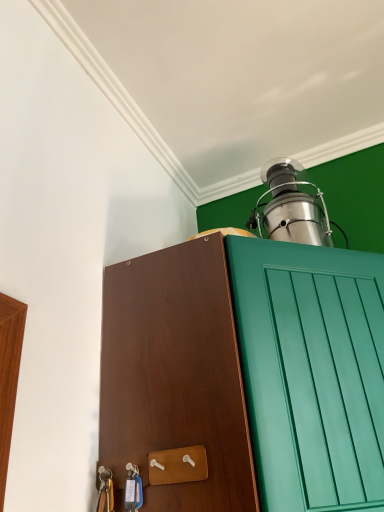
Question: Are stainless steel oil lamp at upper right and brown wood cabinet at center far apart?

Choices:
 (A) yes
 (B) no

Answer: (B)

Question: Can we say stainless steel oil lamp at upper right lies outside brown wood cabinet at center?

Choices:
 (A) no
 (B) yes

Answer: (B)

Question: Can brown wood cabinet at center be found inside stainless steel oil lamp at upper right?

Choices:
 (A) yes
 (B) no

Answer: (B)

Question: Does stainless steel oil lamp at upper right come in front of brown wood cabinet at center?

Choices:
 (A) no
 (B) yes

Answer: (A)

Question: From the image's perspective, is stainless steel oil lamp at upper right below brown wood cabinet at center?

Choices:
 (A) yes
 (B) no

Answer: (B)

Question: Does stainless steel oil lamp at upper right have a greater height compared to brown wood cabinet at center?

Choices:
 (A) no
 (B) yes

Answer: (A)

Question: Is stainless steel oil lamp at upper right completely or partially inside brown wood cabinet at center?

Choices:
 (A) no
 (B) yes

Answer: (A)

Question: Does brown wood cabinet at center have a greater height compared to stainless steel oil lamp at upper right?

Choices:
 (A) no
 (B) yes

Answer: (B)

Question: Does brown wood cabinet at center have a lesser height compared to stainless steel oil lamp at upper right?

Choices:
 (A) yes
 (B) no

Answer: (B)

Question: Can you confirm if brown wood cabinet at center is positioned to the right of stainless steel oil lamp at upper right?

Choices:
 (A) yes
 (B) no

Answer: (B)

Question: Is brown wood cabinet at center not inside stainless steel oil lamp at upper right?

Choices:
 (A) yes
 (B) no

Answer: (A)

Question: Is the position of brown wood cabinet at center more distant than that of stainless steel oil lamp at upper right?

Choices:
 (A) no
 (B) yes

Answer: (A)

Question: Would you say stainless steel oil lamp at upper right is inside or outside brown wood cabinet at center?

Choices:
 (A) inside
 (B) outside

Answer: (B)